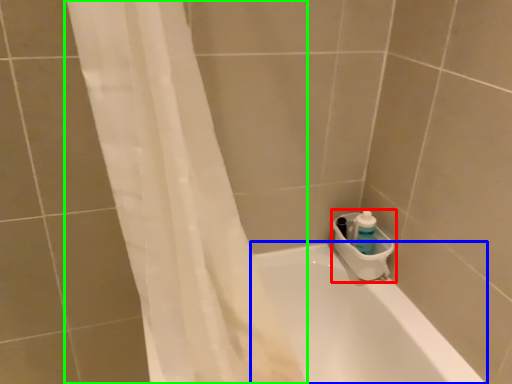
Question: Based on their relative distances, which object is farther from sink (highlighted by a red box)? Choose from bathtub (highlighted by a blue box) and shower curtain (highlighted by a green box).

Choices:
 (A) bathtub
 (B) shower curtain

Answer: (B)